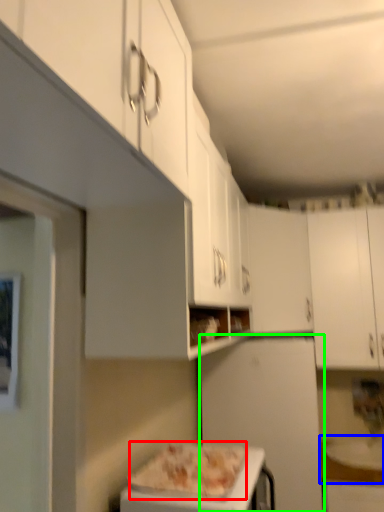
Question: Which object is the farthest from pizza (highlighted by a red box)? Choose among these: counter top (highlighted by a blue box) or appliance (highlighted by a green box).

Choices:
 (A) counter top
 (B) appliance

Answer: (A)